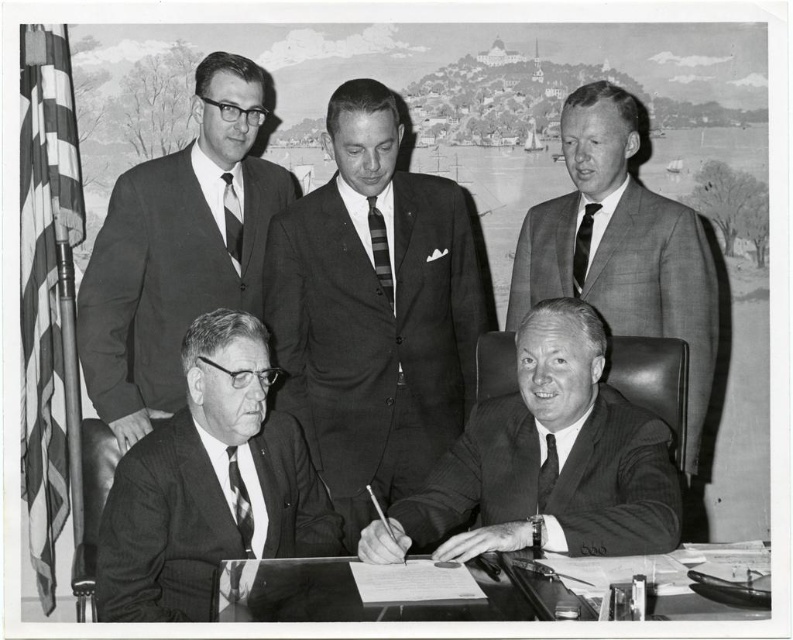
Question: Where is striped fabric tie at center located in relation to matte black tie at lower right in the image?

Choices:
 (A) left
 (B) right

Answer: (A)

Question: Can you confirm if transparent glass table at lower center is smaller than striped fabric tie at lower left?

Choices:
 (A) no
 (B) yes

Answer: (A)

Question: Which point appears closest to the camera in this image?

Choices:
 (A) (688, 272)
 (B) (262, 332)
 (C) (358, 304)
 (D) (546, 452)

Answer: (B)

Question: Does smooth suit at center have a smaller size compared to matte black tie at lower right?

Choices:
 (A) yes
 (B) no

Answer: (B)

Question: Which point appears farthest from the camera in this image?

Choices:
 (A) (374, 259)
 (B) (148, 301)
 (C) (718, 305)

Answer: (C)

Question: Which of the following is the farthest from the observer?

Choices:
 (A) smooth suit at upper left
 (B) striped fabric tie at lower left
 (C) striped fabric tie at center
 (D) striped silk tie at upper left

Answer: (D)